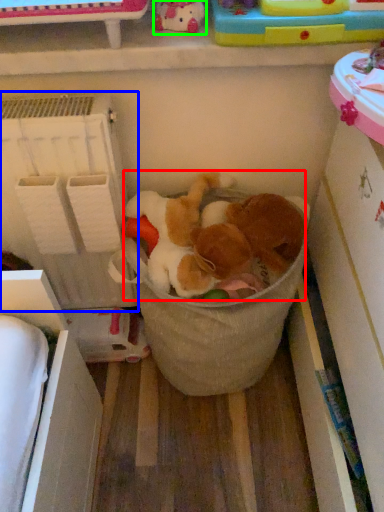
Question: Which object is the farthest from toy (highlighted by a red box)? Choose among these: shelf (highlighted by a blue box) or toy (highlighted by a green box).

Choices:
 (A) shelf
 (B) toy

Answer: (B)